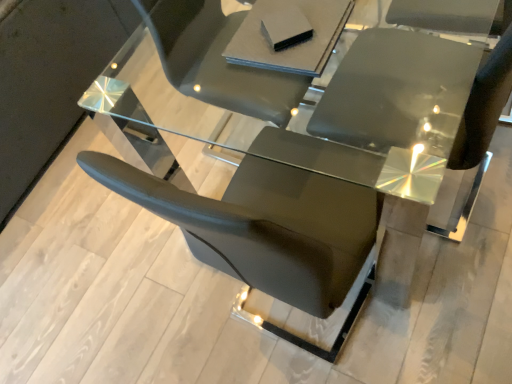
Question: Is matte gray book at upper center, the 1th table in the bottom-to-top sequence, in front of or behind transparent glass table at center, arranged as the 1th table when viewed from the top, in the image?

Choices:
 (A) front
 (B) behind

Answer: (B)

Question: From the image's perspective, relative to transparent glass table at center, arranged as the first table when viewed from the front, is matte gray book at upper center, the 1th table in the bottom-to-top sequence, above or below?

Choices:
 (A) below
 (B) above

Answer: (A)

Question: Which of these objects is positioned closest to the matte gray book at upper center, which is the second table from front to back?

Choices:
 (A) glossy black chair at center
 (B) transparent glass table at center, arranged as the first table when viewed from the front

Answer: (B)

Question: Estimate the real-world distances between objects in this image. Which object is farther from the glossy black chair at center?

Choices:
 (A) transparent glass table at center, which is the 2th table in back-to-front order
 (B) matte gray book at upper center, positioned as the 2th table in top-to-bottom order

Answer: (B)